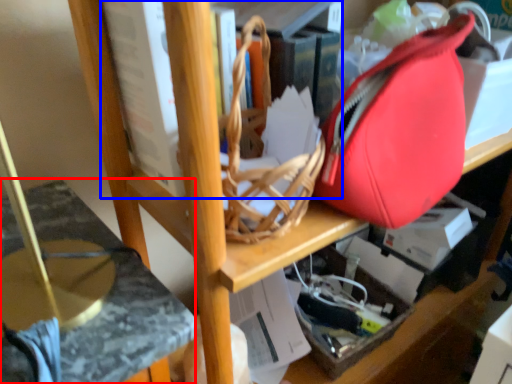
Question: Which object appears farthest to the camera in this image, swivel chair (highlighted by a red box) or book (highlighted by a blue box)?

Choices:
 (A) swivel chair
 (B) book

Answer: (B)